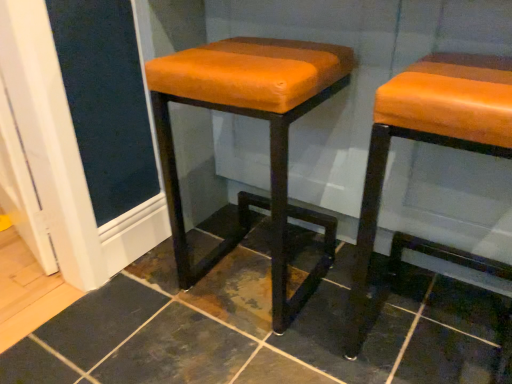
Where is `free location to the left of orange leather stool at right, the second stool viewed from the left`? This screenshot has height=384, width=512. free location to the left of orange leather stool at right, the second stool viewed from the left is located at coordinates [305, 343].